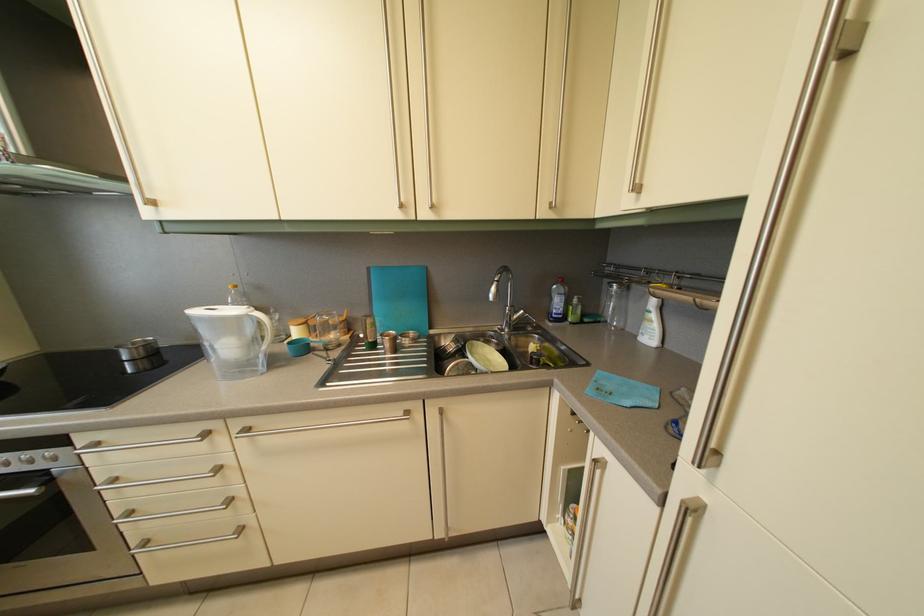
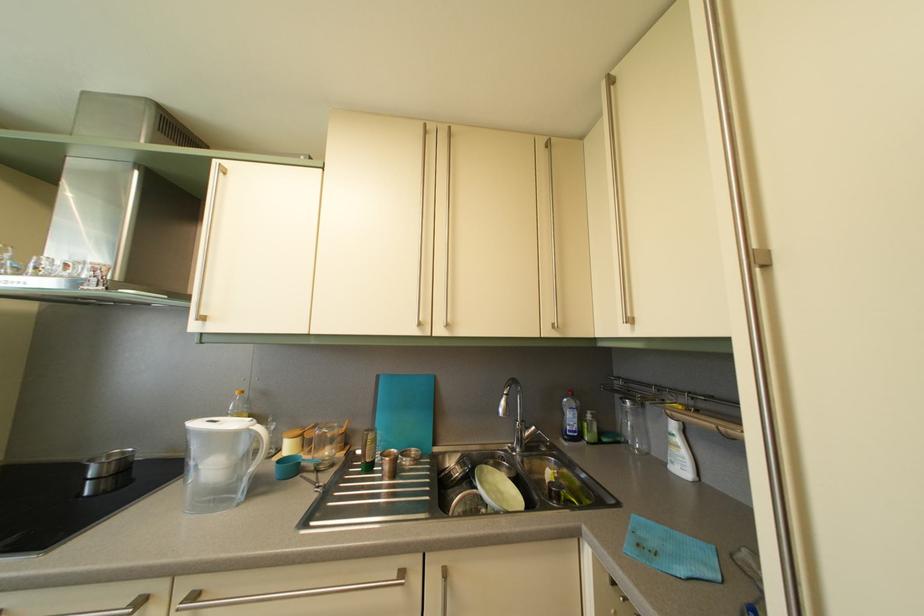
The point at (432, 222) is marked in the first image. Where is the corresponding point in the second image?

(447, 339)